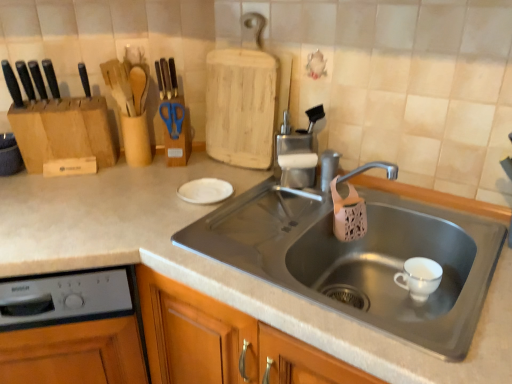
Question: Is black plastic knife at left, which is the 2th knife in left-to-right order, closer to camera compared to metallic gray sink at center?

Choices:
 (A) yes
 (B) no

Answer: (B)

Question: Would you say metallic gray sink at center is part of black plastic knife at left, which is the 2th knife in left-to-right order,'s contents?

Choices:
 (A) no
 (B) yes

Answer: (A)

Question: Is metallic gray sink at center at the back of black plastic knife at left, which is the 2th knife in left-to-right order?

Choices:
 (A) no
 (B) yes

Answer: (A)

Question: Is black plastic knife at left, marked as the 2th knife in a right-to-left arrangement, further to the viewer compared to metallic gray sink at center?

Choices:
 (A) no
 (B) yes

Answer: (B)

Question: Is black plastic knife at left, marked as the 2th knife in a right-to-left arrangement, located outside metallic gray sink at center?

Choices:
 (A) no
 (B) yes

Answer: (B)

Question: From the image's perspective, is black plastic knife at left, which is the 2th knife in left-to-right order, on metallic gray sink at center?

Choices:
 (A) yes
 (B) no

Answer: (A)

Question: Can gray plastic dishwasher at lower left be found inside blue plastic scissors at upper center?

Choices:
 (A) yes
 (B) no

Answer: (B)

Question: Is blue plastic scissors at upper center to the right of gray plastic dishwasher at lower left from the viewer's perspective?

Choices:
 (A) no
 (B) yes

Answer: (B)

Question: Does blue plastic scissors at upper center turn towards gray plastic dishwasher at lower left?

Choices:
 (A) no
 (B) yes

Answer: (A)

Question: Does blue plastic scissors at upper center appear on the left side of gray plastic dishwasher at lower left?

Choices:
 (A) no
 (B) yes

Answer: (A)

Question: Is blue plastic scissors at upper center positioned before gray plastic dishwasher at lower left?

Choices:
 (A) no
 (B) yes

Answer: (A)

Question: Is blue plastic scissors at upper center turned away from gray plastic dishwasher at lower left?

Choices:
 (A) yes
 (B) no

Answer: (B)

Question: Is black matte knife at left, positioned as the third knife in right-to-left order, at the right side of blue plastic scissors at upper center?

Choices:
 (A) no
 (B) yes

Answer: (A)